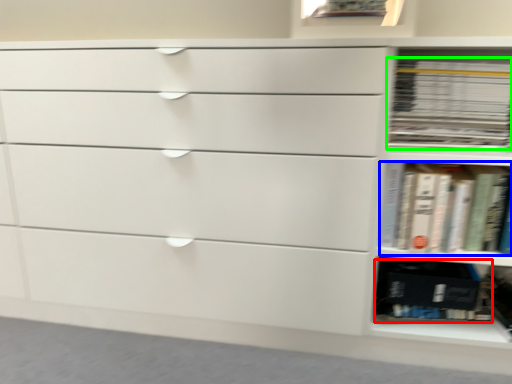
Question: Which is nearer to the paperback book (highlighted by a red box)? book (highlighted by a blue box) or book (highlighted by a green box).

Choices:
 (A) book
 (B) book

Answer: (A)